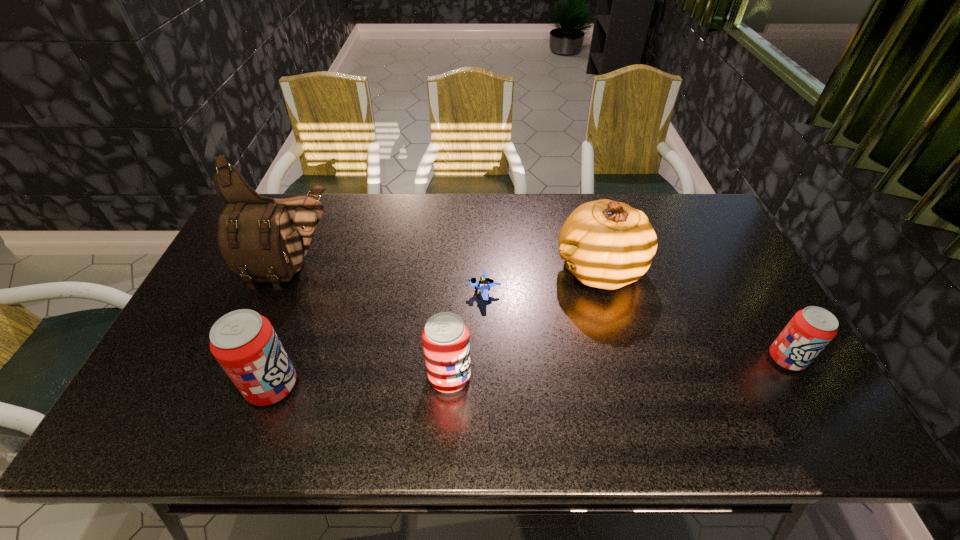
To achieve even spacing by inserting another pop_(soda) among them, please point to a vacant spot for this new pop_(soda). Please provide its 2D coordinates. Your answer should be formatted as a tuple, i.e. [(x, y)], where the tuple contains the x and y coordinates of a point satisfying the conditions above.

[(620, 367)]